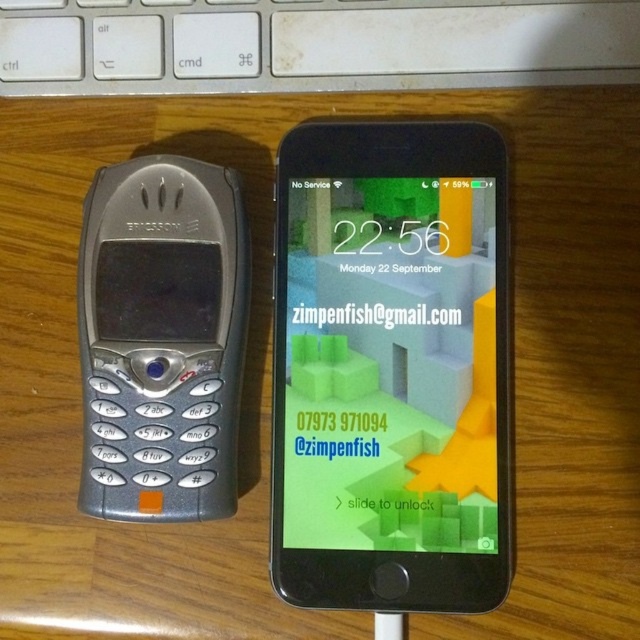
You are a delivery robot with a package that is 12 inches long. You need to place it on the wooden surface between the white plastic keyboard at upper center and the silver metallic phone at left. Is there enough space between them to fit the package?

The distance between the white plastic keyboard at upper center and the silver metallic phone at left is 10.72 inches, so the 12 inch package is too long to fit in the space between them.

You are setting up a phone stand on a desk. You have a matte black smartphone at center and a silver metallic phone at left. Which phone should you place in the stand if the stand is designed for taller devices?

The matte black smartphone at center is taller than the silver metallic phone at left, so you should place the matte black smartphone at center in the stand.